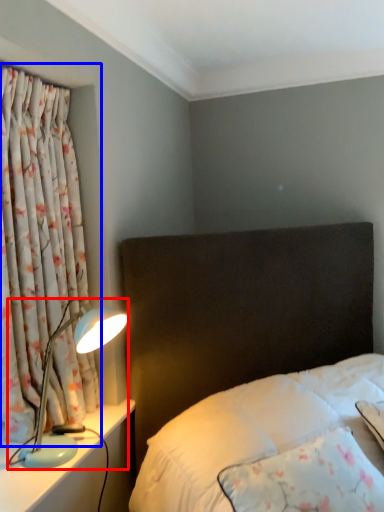
Question: Which of the following is the closest to the observer, lamp (highlighted by a red box) or curtain (highlighted by a blue box)?

Choices:
 (A) lamp
 (B) curtain

Answer: (B)